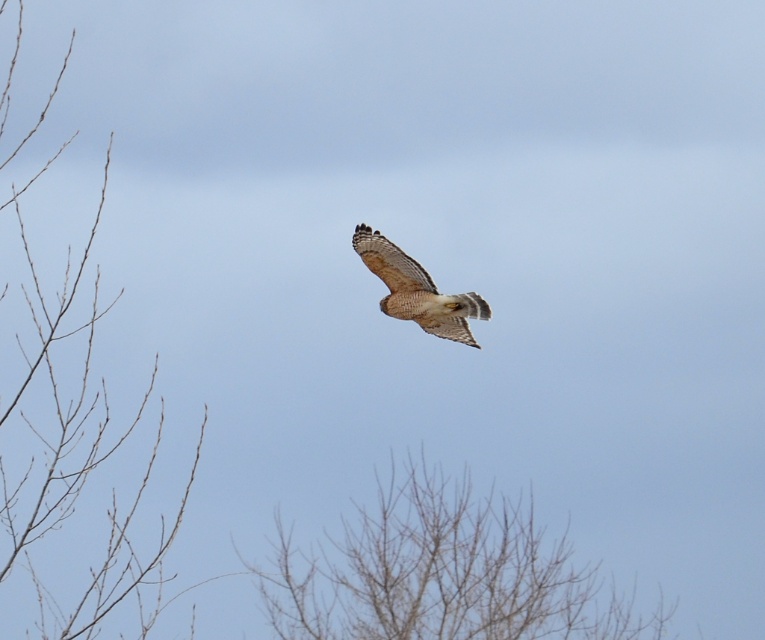
You are a birdwatcher observing the scene. You notice the bare branches at center and the brown feathered eagle at center. Which object is closer to you?

The bare branches at center are closer to you because they are positioned further to the viewer than the brown feathered eagle at center.

You are a drone operator flying a drone that is 1.5 meters wide. You want to fly your drone through the space between the bare branches at left and the brown feathered eagle at center. Can your drone fit through that space?

The distance between the bare branches at left and the brown feathered eagle at center is 3.34 meters. Since the drone is 1.5 meters wide, it can fit through the space as the distance is wider than the drone.